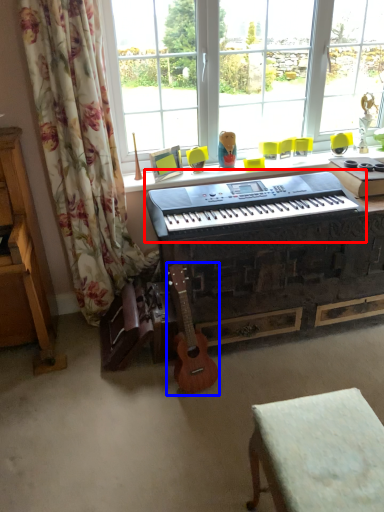
Question: Among these objects, which one is nearest to the camera, musical keyboard (highlighted by a red box) or guitar (highlighted by a blue box)?

Choices:
 (A) musical keyboard
 (B) guitar

Answer: (A)